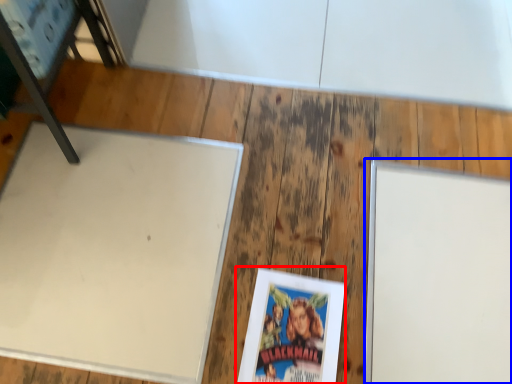
Question: Which object appears farthest to the camera in this image, paperback book (highlighted by a red box) or bulletin board (highlighted by a blue box)?

Choices:
 (A) paperback book
 (B) bulletin board

Answer: (B)